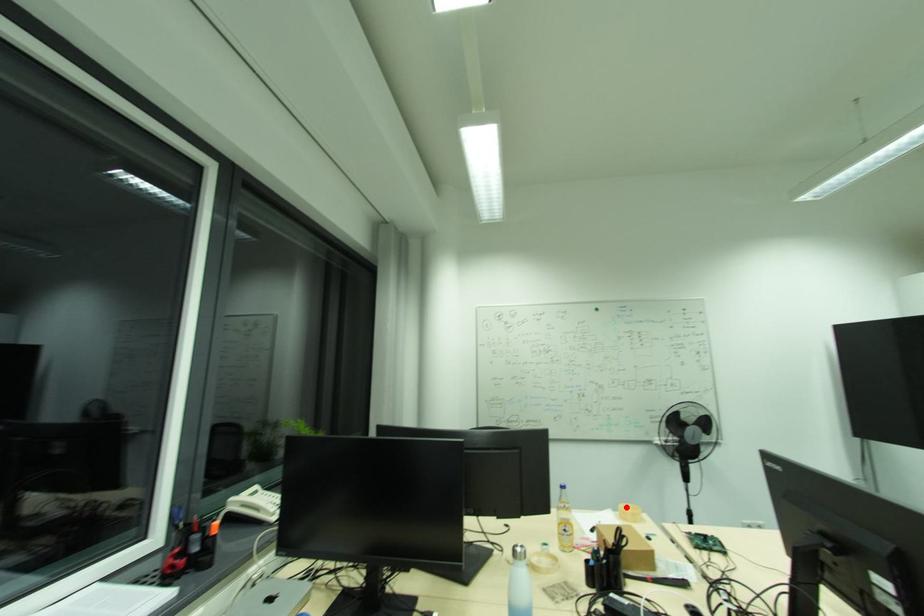
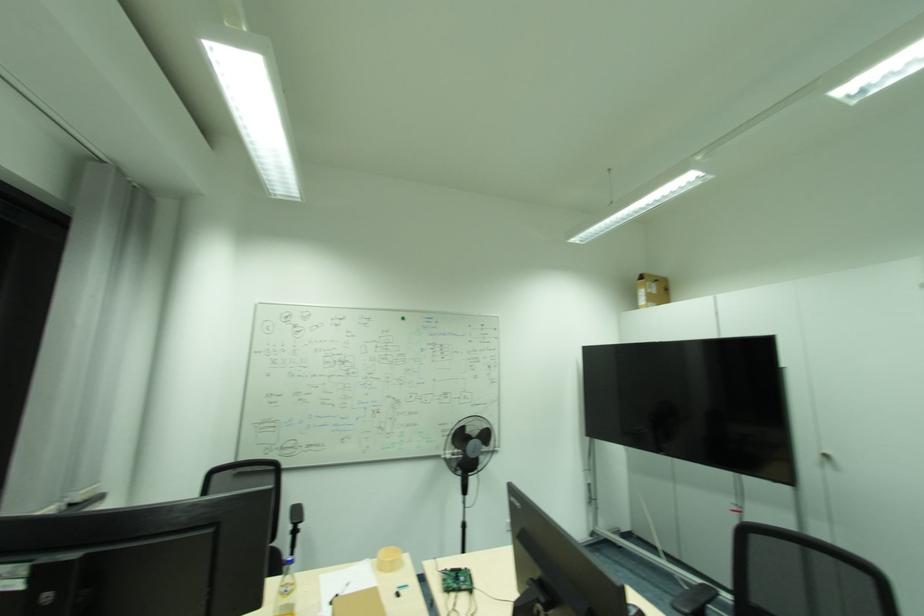
Locate, in the second image, the point that corresponds to the highlighted location in the first image.

(386, 553)